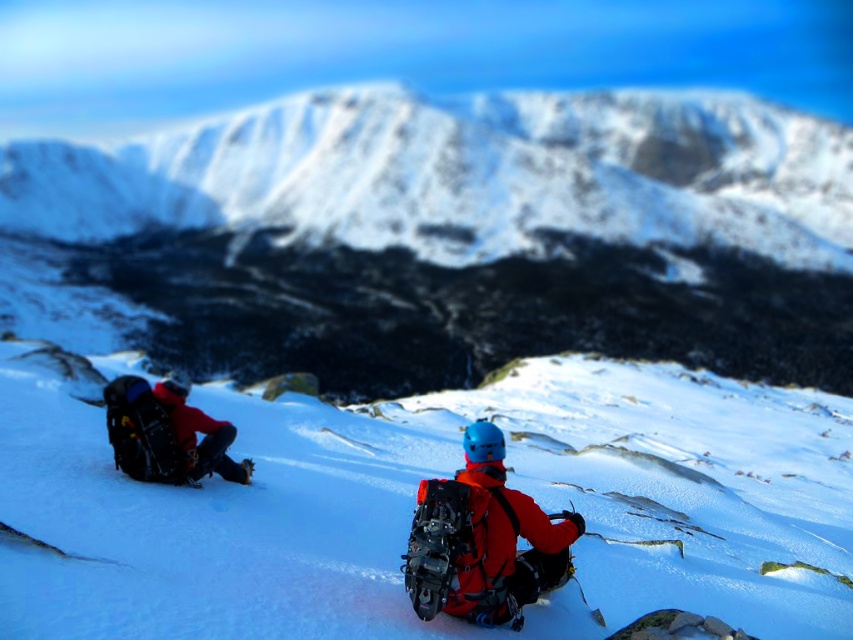
You are a hiker planning to take a photo of the snowy mountain at upper center and the matte orange jacket at center. Which object should you focus on first if you want to capture both in a single frame without moving the camera?

You should focus on the snowy mountain at upper center first because it is larger than the matte orange jacket at center, allowing you to frame it properly before adjusting for the smaller object.

In the scene shown: You are planning to set up a temporary shelter for climbers on the snowy mountain at upper center. Based on its location, would you place the shelter closer to the top or the base of the mountain?

The snowy mountain at upper center is located at point (444, 237), which suggests it is positioned in the upper central area of the image. Since shelters are typically placed at the base for accessibility and safety, the shelter should be placed closer to the base rather than the top.

You are a mountaineer planning to set up a campsite. You have two options for the location of your tent. The first option is at the point marked by the coordinates point [444,237]. The second option is somewhere else on the slope. Considering the terrain and safety, which location would be safer for setting up your tent?

The safer location would be the second option because at point [444,237] there is a snowy mountain at upper center, which might be prone to avalanches or unstable snow conditions.